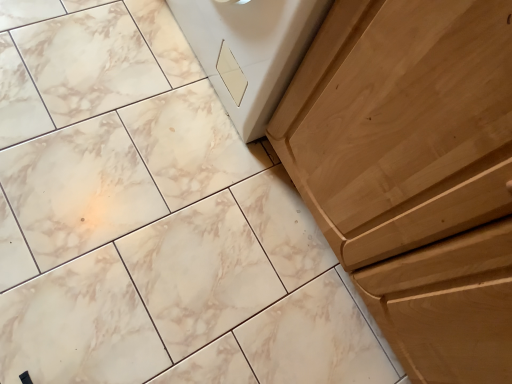
The width and height of the screenshot is (512, 384). What are the coordinates of `natural wood cabinet at right` in the screenshot? It's located at (414, 173).

This screenshot has width=512, height=384. Describe the element at coordinates (414, 173) in the screenshot. I see `natural wood cabinet at right` at that location.

What is the approximate width of natural wood cabinet at right?

natural wood cabinet at right is 24.01 inches in width.

The width and height of the screenshot is (512, 384). Identify the location of natural wood cabinet at right. (414, 173).